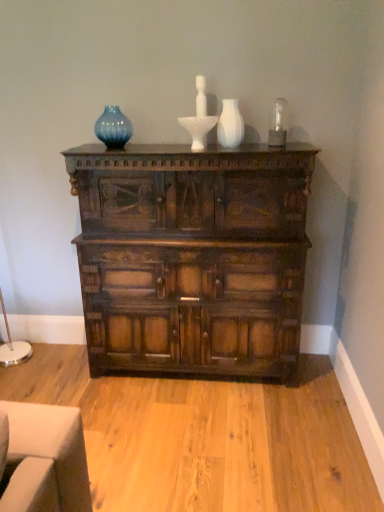
Question: Is dark wood chest of drawers at center at the back of blue glass vase at upper center?

Choices:
 (A) no
 (B) yes

Answer: (A)

Question: Considering the relative sizes of blue glass vase at upper center and dark wood chest of drawers at center in the image provided, is blue glass vase at upper center wider than dark wood chest of drawers at center?

Choices:
 (A) yes
 (B) no

Answer: (B)

Question: Considering the relative positions of blue glass vase at upper center and dark wood chest of drawers at center in the image provided, is blue glass vase at upper center to the left of dark wood chest of drawers at center from the viewer's perspective?

Choices:
 (A) yes
 (B) no

Answer: (A)

Question: Is blue glass vase at upper center outside dark wood chest of drawers at center?

Choices:
 (A) no
 (B) yes

Answer: (B)

Question: Is blue glass vase at upper center further to camera compared to dark wood chest of drawers at center?

Choices:
 (A) no
 (B) yes

Answer: (B)

Question: Considering the positions of point (240, 291) and point (236, 117), is point (240, 291) closer or farther from the camera than point (236, 117)?

Choices:
 (A) closer
 (B) farther

Answer: (B)

Question: Visually, is dark wood chest of drawers at center positioned to the left or to the right of white matte vase at center?

Choices:
 (A) left
 (B) right

Answer: (A)

Question: Considering their positions, is dark wood chest of drawers at center located in front of or behind white matte vase at center?

Choices:
 (A) front
 (B) behind

Answer: (A)

Question: In terms of width, does dark wood chest of drawers at center look wider or thinner when compared to white matte vase at center?

Choices:
 (A) thin
 (B) wide

Answer: (B)

Question: From a real-world perspective, is white matte vase at center above or below dark wood chest of drawers at center?

Choices:
 (A) below
 (B) above

Answer: (B)

Question: Is white matte vase at center in front of or behind dark wood chest of drawers at center in the image?

Choices:
 (A) front
 (B) behind

Answer: (B)

Question: Do you think white matte vase at center is within dark wood chest of drawers at center, or outside of it?

Choices:
 (A) inside
 (B) outside

Answer: (B)

Question: Is white matte vase at center bigger or smaller than dark wood chest of drawers at center?

Choices:
 (A) small
 (B) big

Answer: (A)

Question: From the image's perspective, is blue glass vase at upper center located above or below white matte vase at center?

Choices:
 (A) above
 (B) below

Answer: (A)

Question: From a real-world perspective, is blue glass vase at upper center positioned above or below white matte vase at center?

Choices:
 (A) above
 (B) below

Answer: (A)